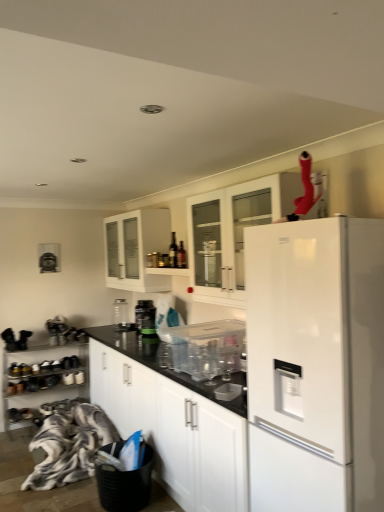
How much space does white matte cabinet at center, arranged as the 2th cabinetry when ordered from the bottom, occupy vertically?

white matte cabinet at center, arranged as the 2th cabinetry when ordered from the bottom, is 36.57 inches tall.

What is the approximate height of clear glass jar at center, which is the 1th appliance in left-to-right order?

clear glass jar at center, which is the 1th appliance in left-to-right order, is 12.93 inches tall.

Describe the element at coordinates (44, 376) in the screenshot. I see `metallic silver shoe rack at lower left, the fourth cabinetry when ordered from top to bottom` at that location.

Measure the distance between point (377, 364) and camera.

Point (377, 364) is 1.63 meters away from camera.

What do you see at coordinates (136, 249) in the screenshot? I see `white glass cabinet at upper center, which ranks as the 3th cabinetry in bottom-to-top order` at bounding box center [136, 249].

Where is `white matte cabinet at center, arranged as the 2th cabinetry when ordered from the bottom`? Image resolution: width=384 pixels, height=512 pixels. white matte cabinet at center, arranged as the 2th cabinetry when ordered from the bottom is located at coordinates (171, 421).

From the image's perspective, is clear glass jar at center, which is the 1th appliance from back to front, beneath fluffy fabric blanket at lower left?

Actually, clear glass jar at center, which is the 1th appliance from back to front, appears above fluffy fabric blanket at lower left in the image.

Looking at the image, does clear glass jar at center, which is the 1th appliance in left-to-right order, seem bigger or smaller compared to fluffy fabric blanket at lower left?

In the image, clear glass jar at center, which is the 1th appliance in left-to-right order, appears to be smaller than fluffy fabric blanket at lower left.

Is clear glass jar at center, the third appliance from the front, in front of or behind fluffy fabric blanket at lower left in the image?

Clearly, clear glass jar at center, the third appliance from the front, is behind fluffy fabric blanket at lower left.

Identify the location of appliance that is the 2nd object located behind the fluffy fabric blanket at lower left. (121, 315).

In order to click on material in front of the metallic silver shoe rack at lower left, the 1th cabinetry when ordered from bottom to top in this screenshot , I will do `click(69, 446)`.

Is metallic silver shoe rack at lower left, the 1th cabinetry when ordered from bottom to top, further to the viewer compared to fluffy fabric blanket at lower left?

Yes, it is.

Is metallic silver shoe rack at lower left, the fourth cabinetry when ordered from top to bottom, smaller than fluffy fabric blanket at lower left?

Yes, metallic silver shoe rack at lower left, the fourth cabinetry when ordered from top to bottom, is smaller than fluffy fabric blanket at lower left.

Choose the correct answer: Is metallic silver shoe rack at lower left, the fourth cabinetry when ordered from top to bottom, inside fluffy fabric blanket at lower left or outside it?

metallic silver shoe rack at lower left, the fourth cabinetry when ordered from top to bottom, is not inside fluffy fabric blanket at lower left, it's outside.

Is white glass cabinet at upper center, the 4th cabinetry ordered from the bottom, far away from white matte cabinet at center, the 3th cabinetry from the top?

That's not correct — white glass cabinet at upper center, the 4th cabinetry ordered from the bottom, is a little close to white matte cabinet at center, the 3th cabinetry from the top.

Can you confirm if white glass cabinet at upper center, the 4th cabinetry ordered from the bottom, is positioned to the left of white matte cabinet at center, arranged as the 2th cabinetry when ordered from the bottom?

No.

Between white glass cabinet at upper center, the 4th cabinetry ordered from the bottom, and white matte cabinet at center, the 3th cabinetry from the top, which one has larger width?

With larger width is white matte cabinet at center, the 3th cabinetry from the top.

From the image's perspective, which object appears higher, clear glass jar at center, which is the 1th appliance from back to front, or metallic silver shoe rack at lower left, the 1th cabinetry when ordered from bottom to top?

clear glass jar at center, which is the 1th appliance from back to front, is shown above in the image.

From a real-world perspective, is clear glass jar at center, which is the 1th appliance in left-to-right order, above or below metallic silver shoe rack at lower left, the 1th cabinetry when ordered from bottom to top?

From a real-world perspective, clear glass jar at center, which is the 1th appliance in left-to-right order, is physically above metallic silver shoe rack at lower left, the 1th cabinetry when ordered from bottom to top.

Is clear glass jar at center, acting as the third appliance starting from the right, situated inside metallic silver shoe rack at lower left, the fourth cabinetry when ordered from top to bottom, or outside?

clear glass jar at center, acting as the third appliance starting from the right, cannot be found inside metallic silver shoe rack at lower left, the fourth cabinetry when ordered from top to bottom.

From the picture: From the image's perspective, is clear glass jar at center, acting as the third appliance starting from the right, located above or below transparent plastic container at center, which is counted as the third appliance, starting from the back?

clear glass jar at center, acting as the third appliance starting from the right, is above transparent plastic container at center, which is counted as the third appliance, starting from the back.

Between clear glass jar at center, acting as the third appliance starting from the right, and transparent plastic container at center, arranged as the first appliance when viewed from the front, which one has more height?

Standing taller between the two is clear glass jar at center, acting as the third appliance starting from the right.

How different are the orientations of clear glass jar at center, the third appliance from the front, and transparent plastic container at center, arranged as the first appliance when viewed from the front, in degrees?

clear glass jar at center, the third appliance from the front, and transparent plastic container at center, arranged as the first appliance when viewed from the front, are facing 0.721 degrees away from each other.

Would you say clear glass jar at center, which is the 1th appliance in left-to-right order, contains transparent plastic container at center, which is the 1th appliance from right to left?

Definitely not — transparent plastic container at center, which is the 1th appliance from right to left, is not inside clear glass jar at center, which is the 1th appliance in left-to-right order.

Are transparent plastic container at center, arranged as the first appliance when viewed from the front, and white matte refrigerator at right beside each other?

No, transparent plastic container at center, arranged as the first appliance when viewed from the front, is not touching white matte refrigerator at right.

In the image, is transparent plastic container at center, which is the 1th appliance from right to left, positioned in front of or behind white matte refrigerator at right?

Visually, transparent plastic container at center, which is the 1th appliance from right to left, is located behind white matte refrigerator at right.

From the image's perspective, starting from the white matte refrigerator at right, which appliance is the 1st one above? Please provide its 2D coordinates.

[(206, 348)]

From the image's perspective, is transparent plastic container at center, which is the 1th appliance from right to left, above clear glass jar at center, acting as the third appliance starting from the right?

Actually, transparent plastic container at center, which is the 1th appliance from right to left, appears below clear glass jar at center, acting as the third appliance starting from the right, in the image.

Which is behind, point (206, 374) or point (121, 308)?

The point (121, 308) is behind.

Could you tell me if transparent plastic container at center, which is the 1th appliance from right to left, is turned towards clear glass jar at center, the third appliance from the front?

No, transparent plastic container at center, which is the 1th appliance from right to left, is not turned towards clear glass jar at center, the third appliance from the front.

Is transparent plastic container at center, which is counted as the third appliance, starting from the back, wider than clear glass jar at center, acting as the third appliance starting from the right?

Indeed, transparent plastic container at center, which is counted as the third appliance, starting from the back, has a greater width compared to clear glass jar at center, acting as the third appliance starting from the right.

In order to click on material that appears below the clear glass jar at center, the third appliance from the front (from a real-world perspective) in this screenshot , I will do `click(69, 446)`.

Identify the location of cabinetry that is the 1st object above the fluffy fabric blanket at lower left (from a real-world perspective). (44, 376).

Considering their positions, is clear glass jar at center, the third appliance from the front, positioned further to transparent plastic container at center, which is the 1th appliance from right to left, than white glass cabinet at upper center, placed as the 1th cabinetry when sorted from top to bottom?

clear glass jar at center, the third appliance from the front, is further to transparent plastic container at center, which is the 1th appliance from right to left.

Considering their positions, is fluffy fabric blanket at lower left positioned further to white matte refrigerator at right than clear glass jar at center, which is the 1th appliance from back to front?

clear glass jar at center, which is the 1th appliance from back to front, is further to white matte refrigerator at right.

Based on their spatial positions, is green matte jar at center, the 2th appliance when ordered from left to right, or white glass cabinet at upper center, placed as the 1th cabinetry when sorted from top to bottom, closer to white matte cabinet at center, arranged as the 2th cabinetry when ordered from the bottom?

Among the two, white glass cabinet at upper center, placed as the 1th cabinetry when sorted from top to bottom, is located nearer to white matte cabinet at center, arranged as the 2th cabinetry when ordered from the bottom.

Based on their spatial positions, is green matte jar at center, which is the 2th appliance in front-to-back order, or fluffy fabric blanket at lower left further from white glass cabinet at upper center, which ranks as the 3th cabinetry in bottom-to-top order?

The object further to white glass cabinet at upper center, which ranks as the 3th cabinetry in bottom-to-top order, is fluffy fabric blanket at lower left.

Which object lies further to the anchor point white glass cabinet at upper center, which ranks as the 3th cabinetry in bottom-to-top order, clear glass jar at center, acting as the third appliance starting from the right, or white glass cabinet at upper center, the 4th cabinetry ordered from the bottom?

Based on the image, white glass cabinet at upper center, the 4th cabinetry ordered from the bottom, appears to be further to white glass cabinet at upper center, which ranks as the 3th cabinetry in bottom-to-top order.

Estimate the real-world distances between objects in this image. Which object is closer to clear glass jar at center, the third appliance from the front, green matte jar at center, the 2th appliance when ordered from back to front, or transparent plastic container at center, arranged as the first appliance when viewed from the front?

green matte jar at center, the 2th appliance when ordered from back to front, is closer to clear glass jar at center, the third appliance from the front.

When comparing their distances from white glass cabinet at upper center, the second cabinetry when ordered from top to bottom, does clear glass jar at center, which is the 1th appliance from back to front, or dark brown glass wine bottle at upper center seem further?

clear glass jar at center, which is the 1th appliance from back to front, is further to white glass cabinet at upper center, the second cabinetry when ordered from top to bottom.

Estimate the real-world distances between objects in this image. Which object is further from white glass cabinet at upper center, placed as the 1th cabinetry when sorted from top to bottom, transparent plastic container at center, which is counted as the third appliance, starting from the back, or green matte jar at center, which is the 2th appliance in front-to-back order?

green matte jar at center, which is the 2th appliance in front-to-back order, lies further to white glass cabinet at upper center, placed as the 1th cabinetry when sorted from top to bottom, than the other object.

Locate an element on the screen. The height and width of the screenshot is (512, 384). wine bottle located between white matte cabinet at center, the 3th cabinetry from the top, and white glass cabinet at upper center, the second cabinetry when ordered from top to bottom, in the depth direction is located at coordinates (173, 252).

Identify the location of wine bottle between white matte cabinet at center, the 3th cabinetry from the top, and clear glass jar at center, the third appliance from the front, from front to back. This screenshot has height=512, width=384. (173, 252).

Locate an element on the screen. This screenshot has width=384, height=512. material between white matte cabinet at center, the 3th cabinetry from the top, and clear glass jar at center, which is the 1th appliance in left-to-right order, in the front-back direction is located at coordinates (69, 446).

At what (x,y) coordinates should I click in order to perform the action: click on appliance between white glass cabinet at upper center, which ranks as the 3th cabinetry in bottom-to-top order, and clear glass jar at center, acting as the third appliance starting from the right, from top to bottom. Please return your answer as a coordinate pair (x, y). The height and width of the screenshot is (512, 384). Looking at the image, I should click on (144, 313).